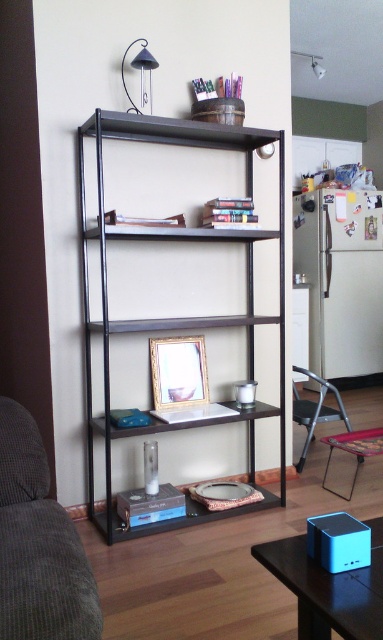
Between blue plastic speaker at lower right and metallic folding table at lower right, which one has less height?

blue plastic speaker at lower right

Is point (299, 563) positioned before point (368, 429)?

Yes, point (299, 563) is closer to viewer.

Where is `blue plastic speaker at lower right`? Image resolution: width=383 pixels, height=640 pixels. blue plastic speaker at lower right is located at coordinates (328, 588).

This screenshot has height=640, width=383. Identify the location of gray corduroy couch at lower left. (39, 545).

Does point (50, 544) come behind point (206, 365)?

No, (50, 544) is in front of (206, 365).

You are a GUI agent. You are given a task and a screenshot of the screen. Output one action in this format:
    pyautogui.click(x=<x>, y=<y>)
    Task: Click on the gray corduroy couch at lower left
    
    Given the screenshot: What is the action you would take?
    pyautogui.click(x=39, y=545)

Does gray corduroy couch at lower left appear over blue plastic speaker at lower right?

Yes.

Does gray corduroy couch at lower left lie in front of blue plastic speaker at lower right?

No, gray corduroy couch at lower left is behind blue plastic speaker at lower right.

Measure the distance between point (16,516) and camera.

The distance of point (16,516) from camera is 4.76 feet.

Identify the location of gray corduroy couch at lower left. Image resolution: width=383 pixels, height=640 pixels. (39, 545).